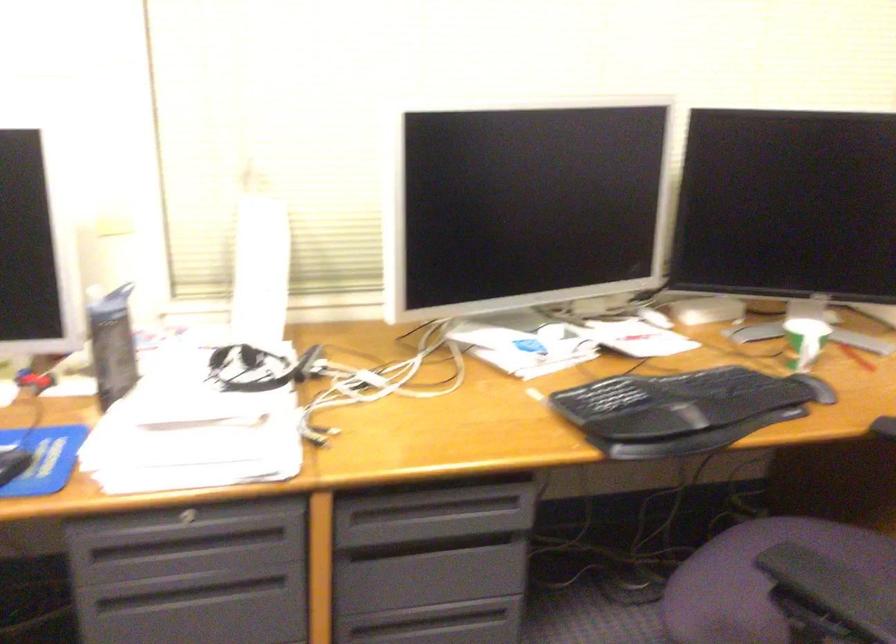
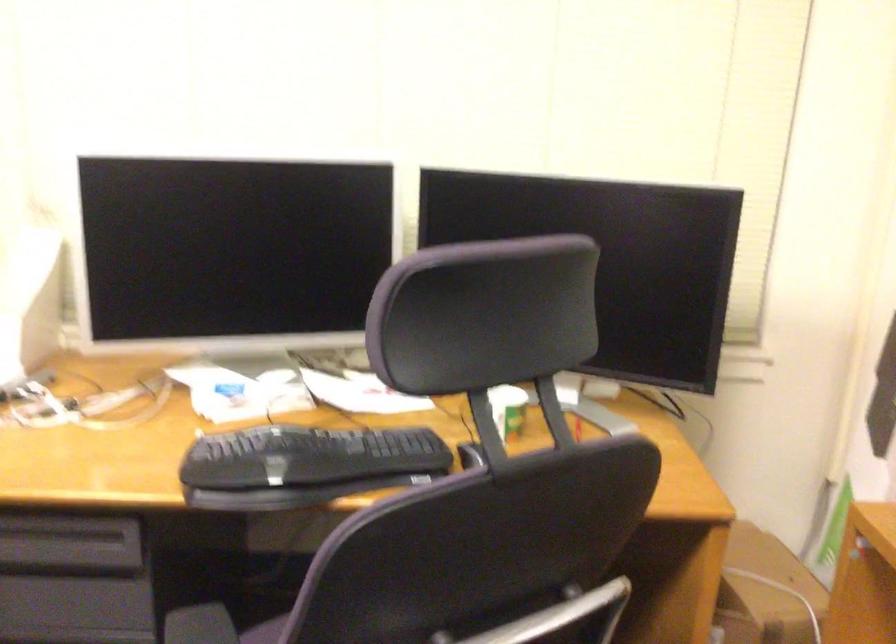
Locate, in the second image, the point that corresponds to the point at 453,525 in the first image.

(66, 552)